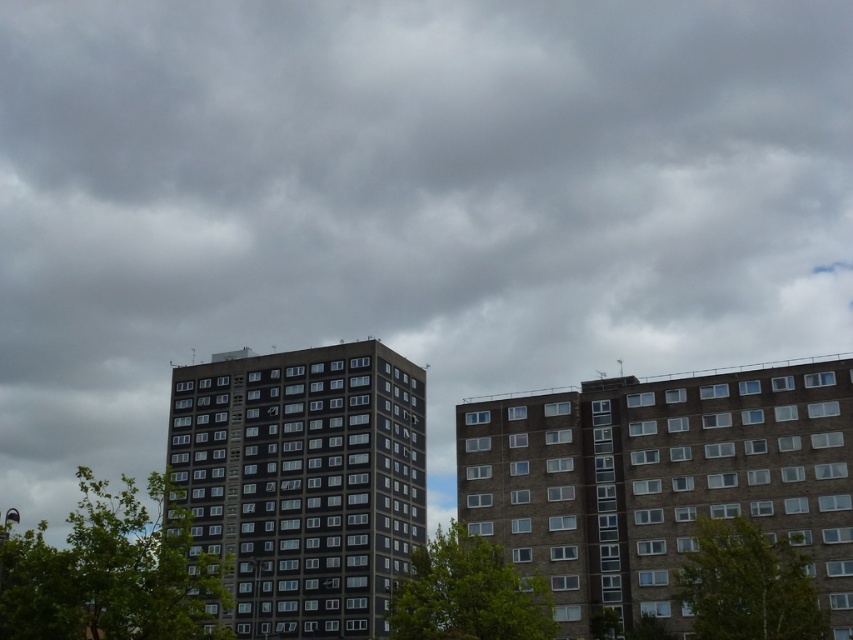
Between green leafy tree at center and green leafy tree at lower center, which one has less height?

→ With less height is green leafy tree at center.

Identify the location of green leafy tree at center. Image resolution: width=853 pixels, height=640 pixels. pyautogui.click(x=747, y=584).

Is dark gray concrete building at center in front of green leafy tree at lower left?

No, dark gray concrete building at center is further to the viewer.

Is point (303, 371) farther from viewer compared to point (45, 548)?

Yes, it is behind point (45, 548).

Which is behind, point (341, 566) or point (102, 506)?

The point (341, 566) is more distant.

Where is `dark gray concrete building at center`? dark gray concrete building at center is located at coordinates (305, 481).

Is green leafy tree at lower left positioned before green leafy tree at lower center?

Yes, green leafy tree at lower left is in front of green leafy tree at lower center.

Can you confirm if green leafy tree at lower left is positioned to the right of green leafy tree at lower center?

Incorrect, green leafy tree at lower left is not on the right side of green leafy tree at lower center.

Where is `green leafy tree at lower left`? green leafy tree at lower left is located at coordinates (109, 573).

Locate an element on the screen. green leafy tree at lower left is located at coordinates (109, 573).